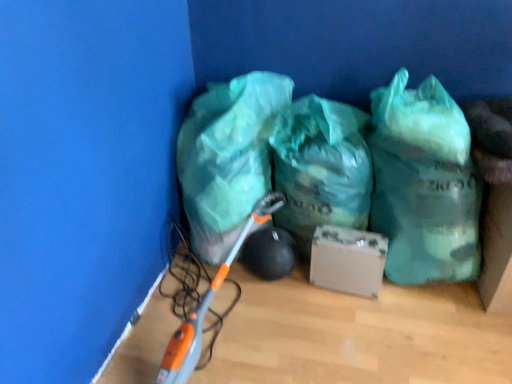
You are a GUI agent. You are given a task and a screenshot of the screen. Output one action in this format:
    pyautogui.click(x=<x>, y=<y>)
    Task: Click on the free space in front of matte cardboard box at center
    This screenshot has height=384, width=512.
    Given the screenshot: What is the action you would take?
    pyautogui.click(x=354, y=327)